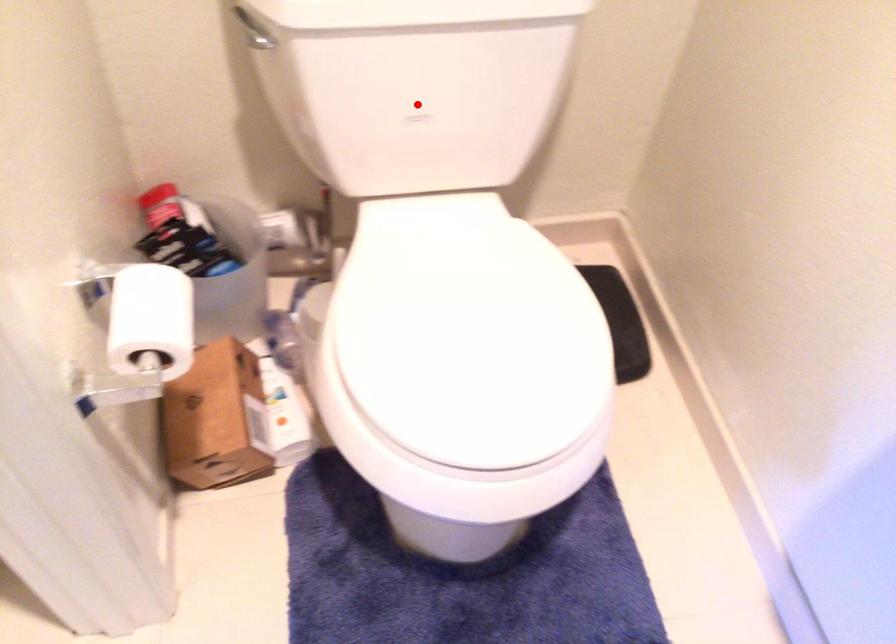
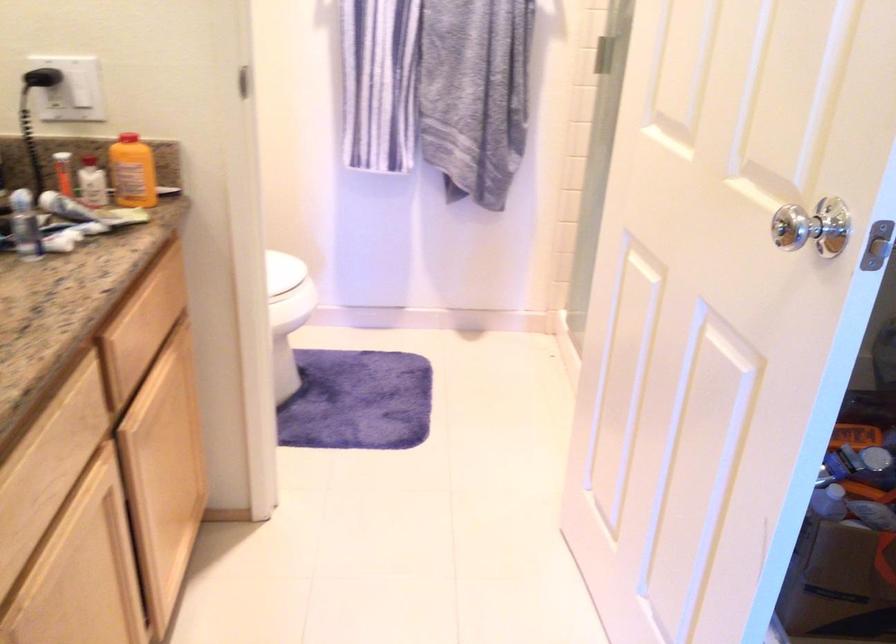
Question: I am providing you with two images of the same scene from different viewpoints. A red point is marked on the first image. Is the red point's position out of view in image 2?

Choices:
 (A) Yes
 (B) No

Answer: (A)